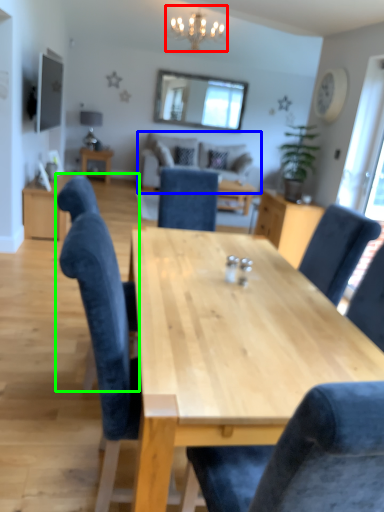
Question: Estimate the real-world distances between objects in this image. Which object is closer to light fixture (highlighted by a red box), couch (highlighted by a blue box) or chair (highlighted by a green box)?

Choices:
 (A) couch
 (B) chair

Answer: (A)